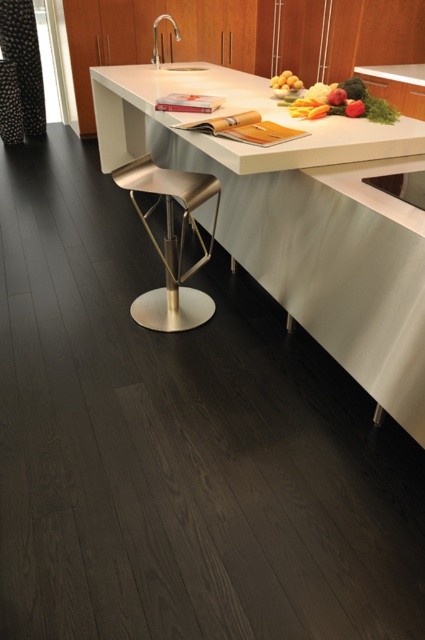
Question: Estimate the real-world distances between objects in this image. Which object is farther from the black textured curtain at left?

Choices:
 (A) vibrant mixed vegetables at center
 (B) white glossy countertop at center
 (C) yellow matte potatoes at upper center

Answer: (A)

Question: Which is farther from the satin gold bar stool at center?

Choices:
 (A) white glossy countertop at center
 (B) black textured curtain at left

Answer: (B)

Question: Does black textured curtain at left appear under yellow matte potatoes at upper center?

Choices:
 (A) no
 (B) yes

Answer: (A)

Question: Which is nearer to the black textured curtain at left?

Choices:
 (A) yellow matte potatoes at upper center
 (B) satin gold bar stool at center

Answer: (A)

Question: Observing the image, what is the correct spatial positioning of white glossy countertop at center in reference to satin gold bar stool at center?

Choices:
 (A) above
 (B) below

Answer: (A)

Question: Is white glossy countertop at center to the right of black textured curtain at left from the viewer's perspective?

Choices:
 (A) yes
 (B) no

Answer: (A)